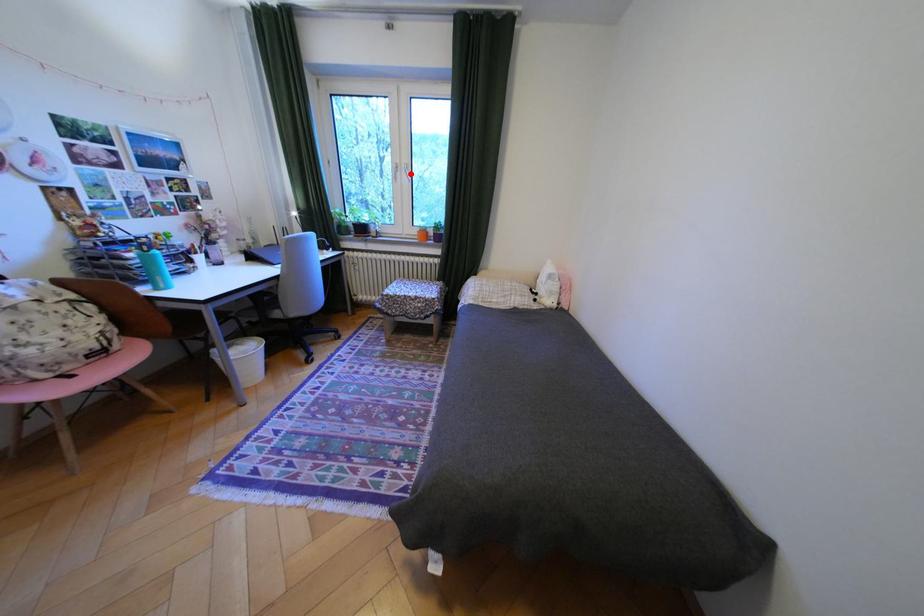
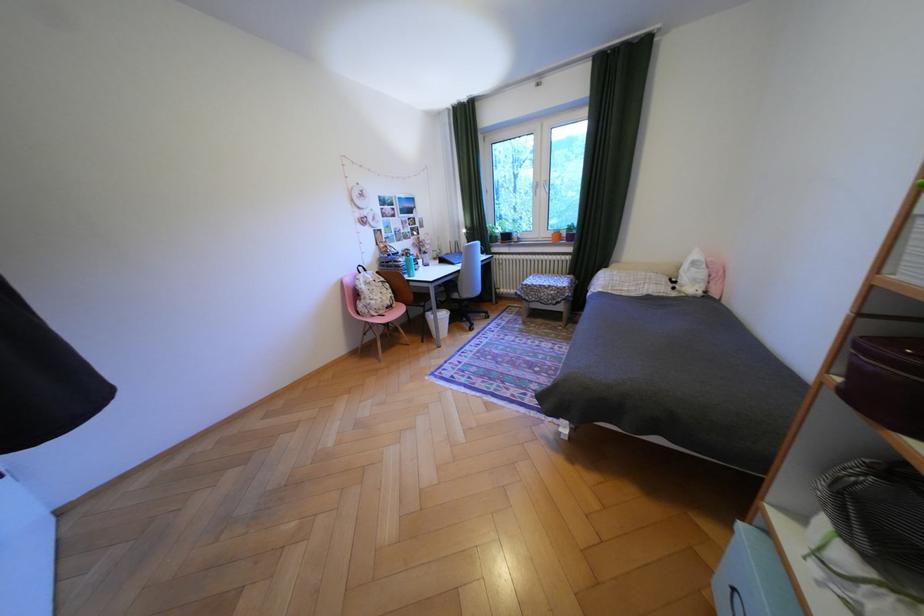
Question: I am providing you with two images of the same scene from different viewpoints. Given a red point in image1, look at the same physical point in image2. Is it:

Choices:
 (A) Closer to the viewpoint
 (B) Farther from the viewpoint

Answer: (A)